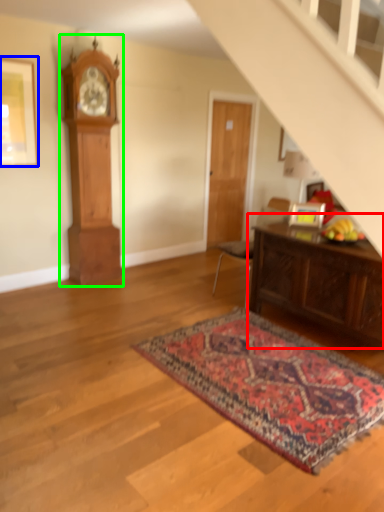
Question: Considering the real-world distances, which object is farthest from table (highlighted by a red box)? picture frame (highlighted by a blue box) or clock (highlighted by a green box)?

Choices:
 (A) picture frame
 (B) clock

Answer: (A)